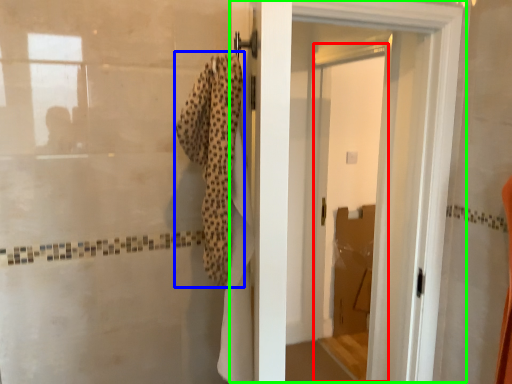
Question: Considering the real-world distances, which object is closest to screen door (highlighted by a red box)? bath towel (highlighted by a blue box) or door (highlighted by a green box).

Choices:
 (A) bath towel
 (B) door

Answer: (B)